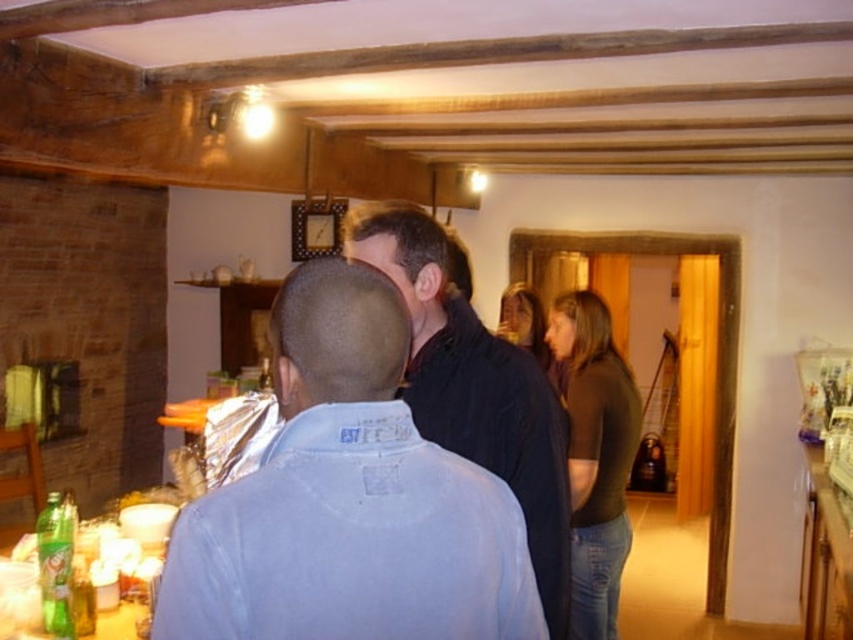
Who is positioned more to the left, black matte jacket at center or green glass bottle at lower left?

green glass bottle at lower left is more to the left.

Does black matte jacket at center have a lesser width compared to green glass bottle at lower left?

No, black matte jacket at center is not thinner than green glass bottle at lower left.

The height and width of the screenshot is (640, 853). Identify the location of black matte jacket at center. (474, 385).

Can you confirm if light blue shirt at center is positioned above black matte jacket at center?

Actually, light blue shirt at center is below black matte jacket at center.

Who is positioned more to the right, light blue shirt at center or black matte jacket at center?

From the viewer's perspective, black matte jacket at center appears more on the right side.

You are a GUI agent. You are given a task and a screenshot of the screen. Output one action in this format:
    pyautogui.click(x=<x>, y=<y>)
    Task: Click on the light blue shirt at center
    This screenshot has height=640, width=853.
    Given the screenshot: What is the action you would take?
    pyautogui.click(x=347, y=499)

Is light blue shirt at center to the right of green glass bottle at lower left from the viewer's perspective?

Yes, light blue shirt at center is to the right of green glass bottle at lower left.

Between light blue shirt at center and green glass bottle at lower left, which one has more height?

light blue shirt at center

Where is `light blue shirt at center`? This screenshot has width=853, height=640. light blue shirt at center is located at coordinates (347, 499).